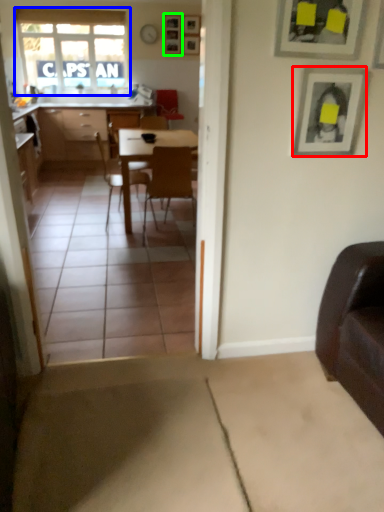
Question: Estimate the real-world distances between objects in this image. Which object is closer to picture frame (highlighted by a red box), window (highlighted by a blue box) or picture frame (highlighted by a green box)?

Choices:
 (A) window
 (B) picture frame

Answer: (B)